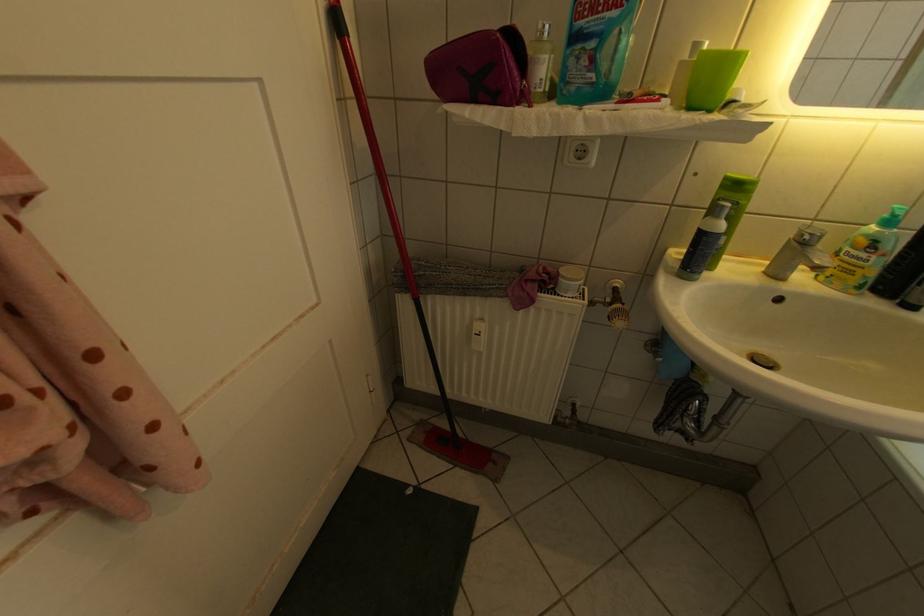
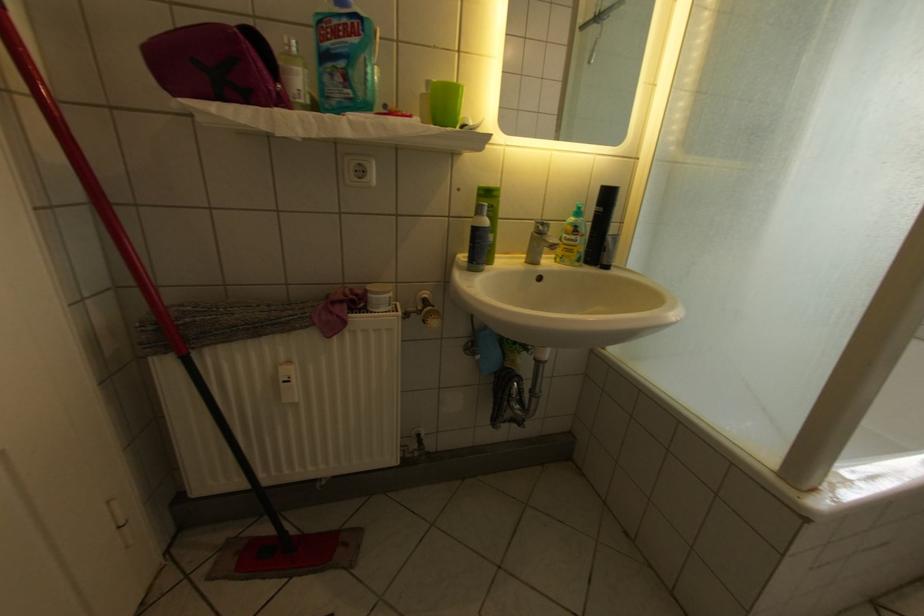
In the second image, find the point that corresponds to pixel 888 257 in the first image.

(590, 238)